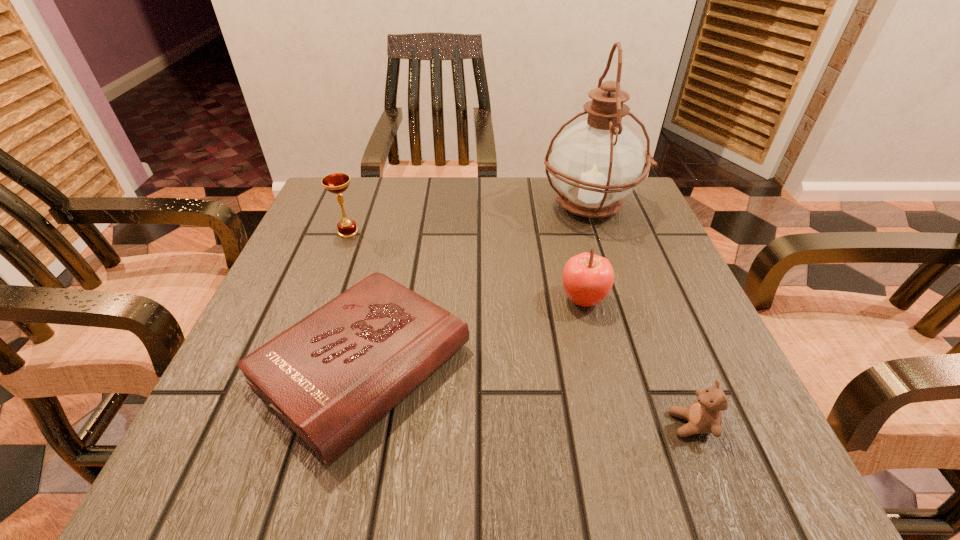
What are the coordinates of `teddy bear that is at the right edge` in the screenshot? It's located at (704, 416).

You are a GUI agent. You are given a task and a screenshot of the screen. Output one action in this format:
    pyautogui.click(x=<x>, y=<y>)
    Task: Click on the object at the far left corner
    This screenshot has height=540, width=960.
    Given the screenshot: What is the action you would take?
    pyautogui.click(x=336, y=183)

This screenshot has width=960, height=540. In order to click on object at the near left corner in this screenshot , I will do `click(331, 376)`.

You are a GUI agent. You are given a task and a screenshot of the screen. Output one action in this format:
    pyautogui.click(x=<x>, y=<y>)
    Task: Click on the object at the far right corner
    
    Given the screenshot: What is the action you would take?
    pyautogui.click(x=596, y=163)

Locate an element on the screen. The image size is (960, 540). object present at the near right corner is located at coordinates (704, 416).

Image resolution: width=960 pixels, height=540 pixels. What are the coordinates of `vacant region at the far edge of the desktop` in the screenshot? It's located at (381, 215).

Locate an element on the screen. This screenshot has height=540, width=960. vacant space at the left edge is located at coordinates (353, 277).

Image resolution: width=960 pixels, height=540 pixels. I want to click on free space at the right edge of the desktop, so click(674, 345).

This screenshot has width=960, height=540. What are the coordinates of `free space at the near left corner of the desktop` in the screenshot? It's located at (197, 435).

Where is `vacant point at the far right corner`? Image resolution: width=960 pixels, height=540 pixels. vacant point at the far right corner is located at coordinates (627, 207).